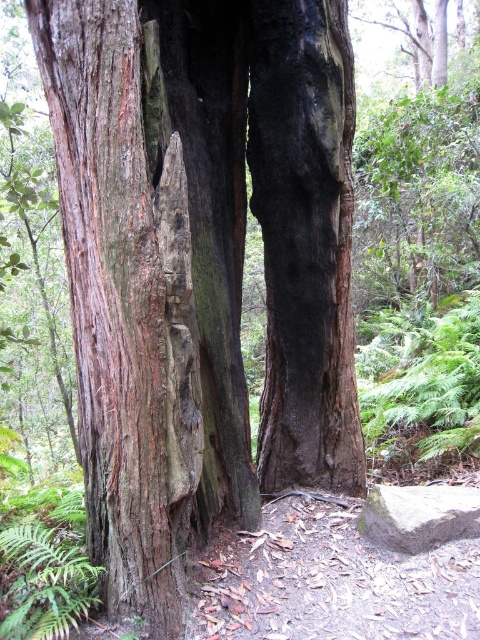
Question: Which of the following is the farthest from the observer?

Choices:
 (A) (182, 218)
 (B) (433, 484)

Answer: (B)

Question: Which object appears closest to the camera in this image?

Choices:
 (A) gray smooth rock at lower right
 (B) rough bark tree trunk at center

Answer: (B)

Question: Can you confirm if rough bark tree trunk at center is positioned above gray smooth rock at lower right?

Choices:
 (A) no
 (B) yes

Answer: (B)

Question: Is rough bark tree trunk at center positioned in front of gray smooth rock at lower right?

Choices:
 (A) yes
 (B) no

Answer: (A)

Question: Is rough bark tree trunk at center closer to camera compared to gray smooth rock at lower right?

Choices:
 (A) no
 (B) yes

Answer: (B)